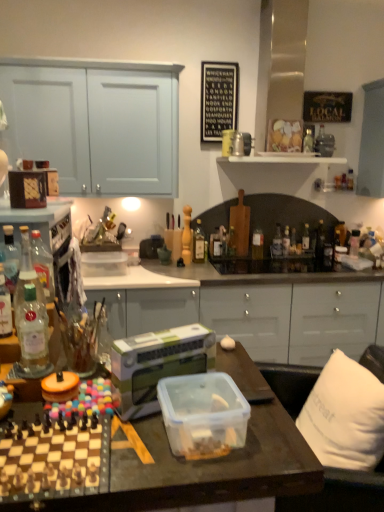
Identify the location of free location in front of translucent glass bottle at center, placed as the 6th bottle when sorted from front to back. (196, 270).